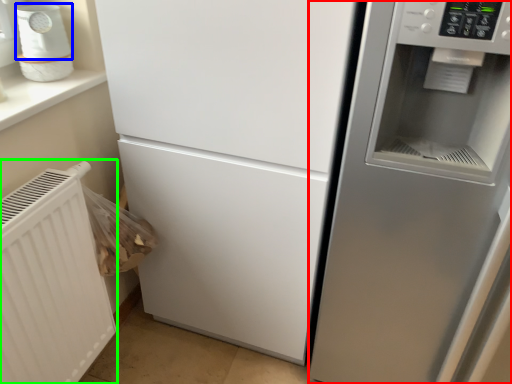
Question: Estimate the real-world distances between objects in this image. Which object is farther from fridge (highlighted by a red box), appliance (highlighted by a blue box) or radiator (highlighted by a green box)?

Choices:
 (A) appliance
 (B) radiator

Answer: (A)